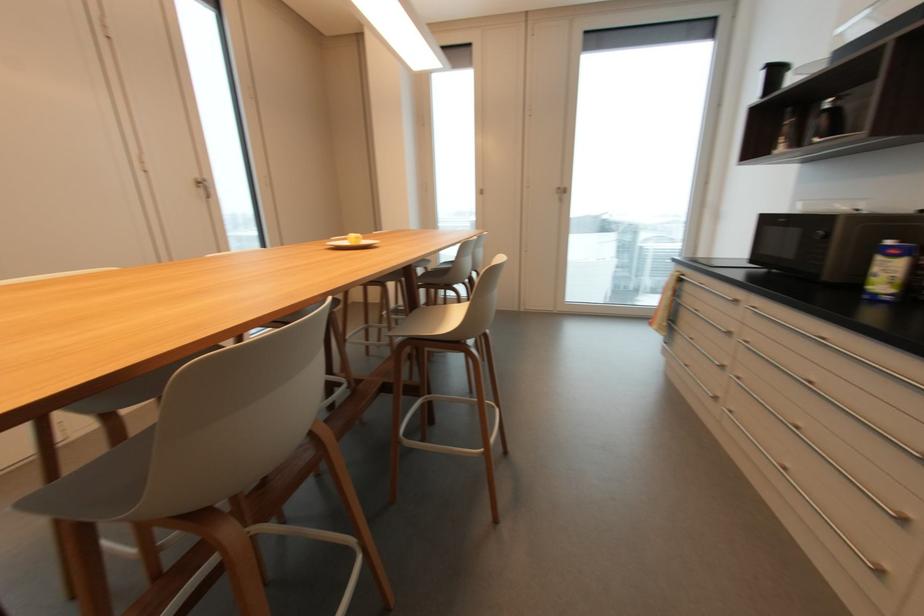
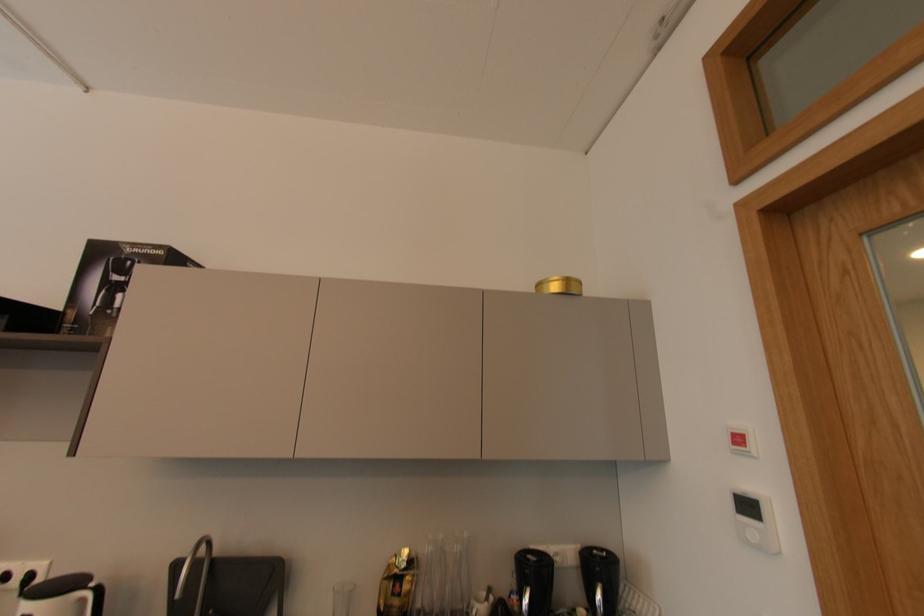
Question: Based on the continuous images, in which direction is the camera rotating? Reply with the corresponding letter.

Choices:
 (A) Left
 (B) Right
 (C) Up
 (D) Down

Answer: (B)